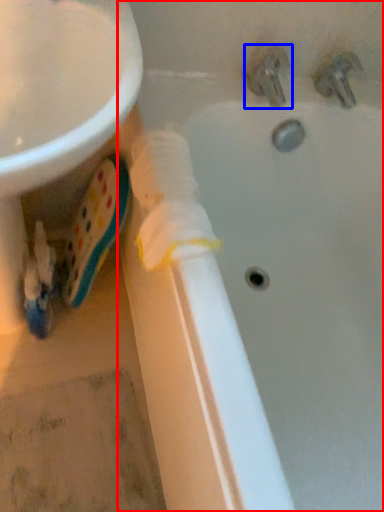
Question: Which of the following is the farthest to the observer, bathtub (highlighted by a red box) or tap (highlighted by a blue box)?

Choices:
 (A) bathtub
 (B) tap

Answer: (B)